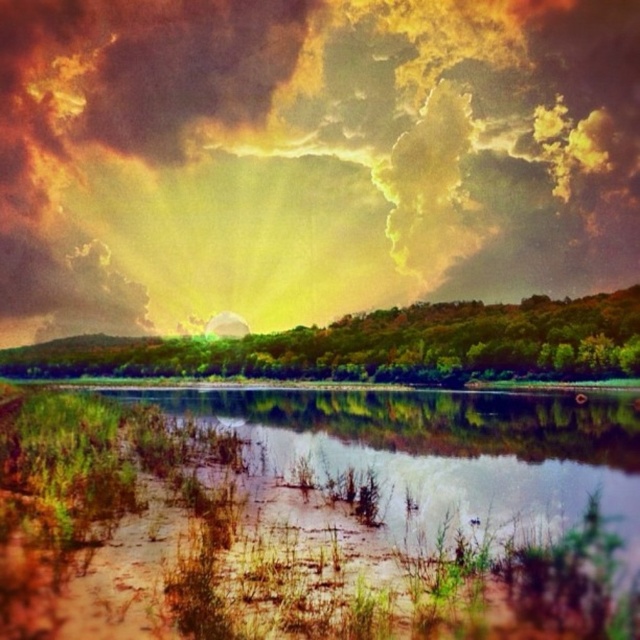
Question: Which point is closer to the camera?

Choices:
 (A) golden textured clouds at upper center
 (B) brown/muddy water at lower center

Answer: (B)

Question: Can you confirm if golden textured clouds at upper center is thinner than brown/muddy water at lower center?

Choices:
 (A) no
 (B) yes

Answer: (A)

Question: Is golden textured clouds at upper center below brown/muddy water at lower center?

Choices:
 (A) no
 (B) yes

Answer: (A)

Question: Can you confirm if golden textured clouds at upper center is smaller than brown/muddy water at lower center?

Choices:
 (A) yes
 (B) no

Answer: (B)

Question: Which of the following is the farthest from the observer?

Choices:
 (A) (467, 436)
 (B) (336, 310)

Answer: (B)